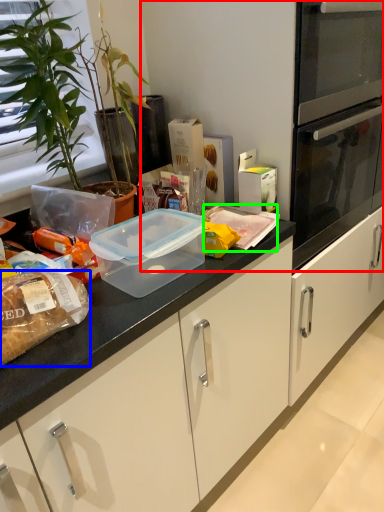
Question: Which object is the closest to the fridge (highlighted by a red box)? Choose among these: food (highlighted by a blue box) or food (highlighted by a green box).

Choices:
 (A) food
 (B) food

Answer: (B)